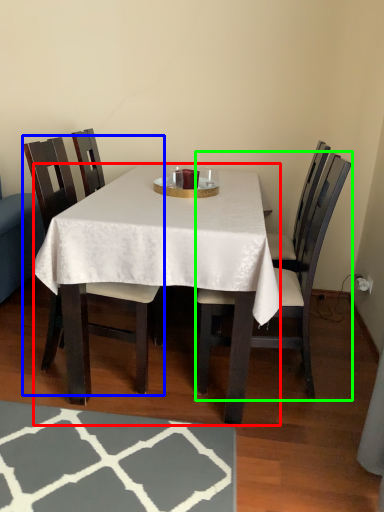
Question: Which is farther away from desk (highlighted by a red box)? chair (highlighted by a blue box) or chair (highlighted by a green box)?

Choices:
 (A) chair
 (B) chair

Answer: (A)